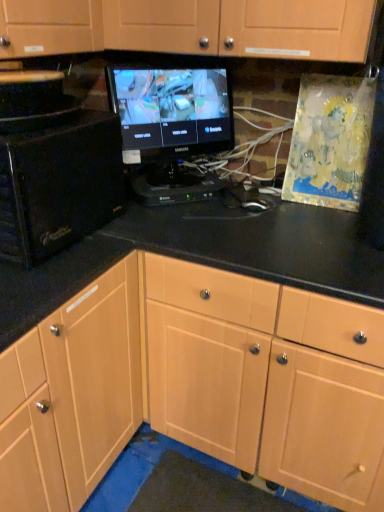
Find the location of a particular element. The image size is (384, 512). free location above light wood cabinet at center (from a real-world perspective) is located at coordinates (284, 234).